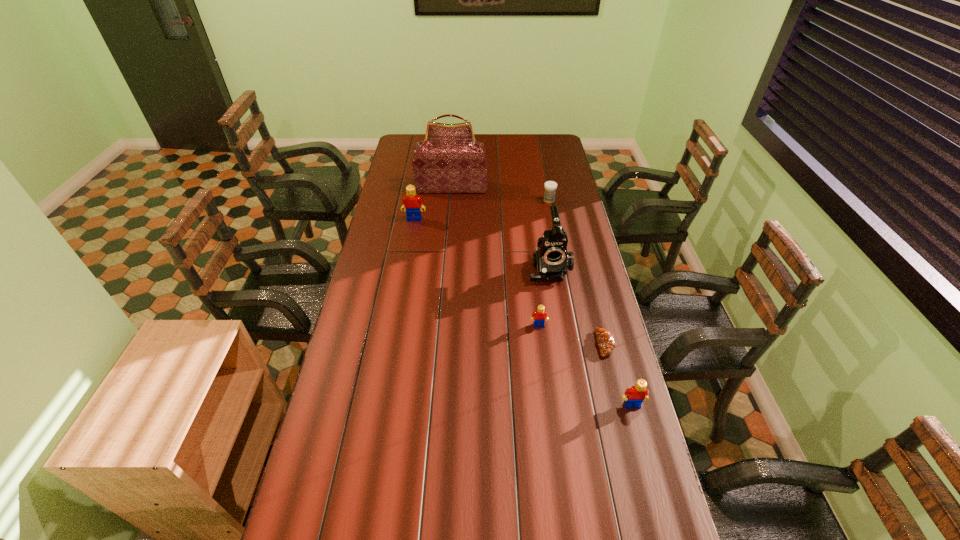
Where is `vacant space in between the shortest Lego and the sixth farthest object`? vacant space in between the shortest Lego and the sixth farthest object is located at coordinates (572, 335).

Where is `free space between the farthest Lego and the sixth nearest object`? free space between the farthest Lego and the sixth nearest object is located at coordinates (482, 210).

Where is `free spot between the shortest Lego and the farthest object`? This screenshot has height=540, width=960. free spot between the shortest Lego and the farthest object is located at coordinates (495, 256).

The image size is (960, 540). Find the location of `vacant area that lies between the second tallest Lego and the second nearest object`. vacant area that lies between the second tallest Lego and the second nearest object is located at coordinates (618, 375).

Where is `vacant area that lies between the farthest object and the rightmost Lego`? The height and width of the screenshot is (540, 960). vacant area that lies between the farthest object and the rightmost Lego is located at coordinates (542, 296).

Choose which object is the fifth nearest neighbor to the third tallest object. Please provide its 2D coordinates. Your answer should be formatted as a tuple, i.e. [(x, y)], where the tuple contains the x and y coordinates of a point satisfying the conditions above.

[(605, 339)]

Find the location of a particular element. This screenshot has width=960, height=540. the sixth closest object to the nearest object is located at coordinates (449, 160).

The width and height of the screenshot is (960, 540). Find the location of `the second closest Lego relative to the rightmost Lego`. the second closest Lego relative to the rightmost Lego is located at coordinates (411, 202).

Point out which Lego is positioned as the nearest to the leftmost Lego. Please provide its 2D coordinates. Your answer should be formatted as a tuple, i.e. [(x, y)], where the tuple contains the x and y coordinates of a point satisfying the conditions above.

[(539, 317)]

Find the location of a particular element. The image size is (960, 540). free space that satisfies the following two spatial constraints: 1. on the lens mount of the fourth farthest object; 2. on the left side of the second nearest object is located at coordinates click(562, 344).